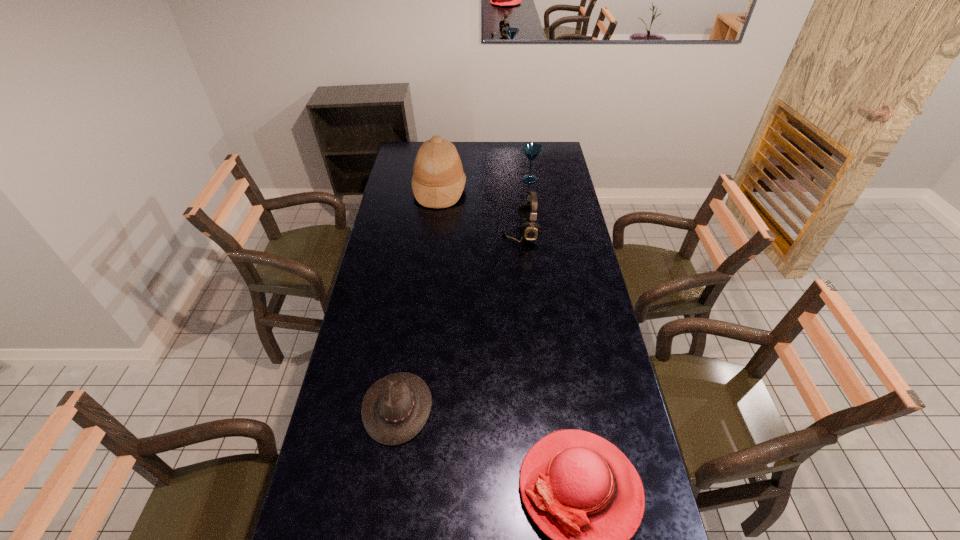
What are the coordinates of `the tallest hat` in the screenshot? It's located at (438, 180).

The width and height of the screenshot is (960, 540). Identify the location of the farthest hat. coord(438,180).

The width and height of the screenshot is (960, 540). Find the location of `headset`. headset is located at coordinates point(528,212).

The width and height of the screenshot is (960, 540). I want to click on martini, so click(532, 150).

You are a GUI agent. You are given a task and a screenshot of the screen. Output one action in this format:
    pyautogui.click(x=<x>, y=<y>)
    Task: Click on the shortest object
    The image size is (960, 540).
    Given the screenshot: What is the action you would take?
    pyautogui.click(x=395, y=408)

Locate an element on the screen. The image size is (960, 540). vacant area situated on the front-facing side of the tallest hat is located at coordinates (539, 189).

Identify the location of vacant region located 0.160m with the microphone on the side of the headset. Image resolution: width=960 pixels, height=540 pixels. (466, 232).

Image resolution: width=960 pixels, height=540 pixels. I want to click on free spot located with the microphone on the side of the headset, so click(x=417, y=232).

Identify the location of vacant space located with the microphone on the side of the headset. pos(434,232).

At what (x,y) coordinates should I click in order to perform the action: click on free space located 0.050m on the right of the martini. Please return your answer as a coordinate pair (x, y). This screenshot has height=540, width=960. Looking at the image, I should click on (550, 179).